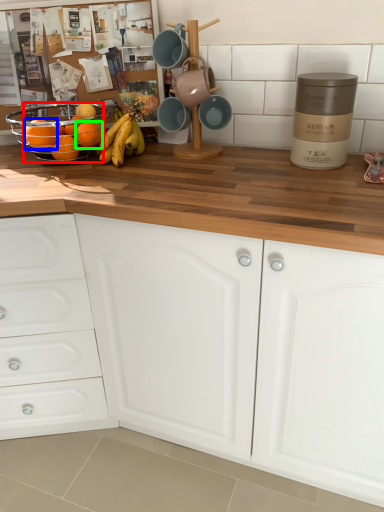
Question: Estimate the real-world distances between objects in this image. Which object is farther from orange (highlighted by a red box), orange (highlighted by a blue box) or orange (highlighted by a green box)?

Choices:
 (A) orange
 (B) orange

Answer: (B)